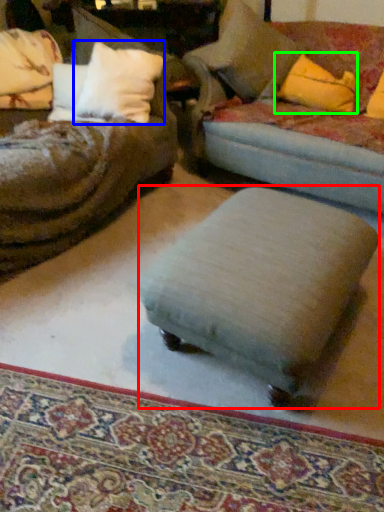
Question: Estimate the real-world distances between objects in this image. Which object is closer to stool (highlighted by a red box), pillow (highlighted by a blue box) or throw pillow (highlighted by a green box)?

Choices:
 (A) pillow
 (B) throw pillow

Answer: (A)